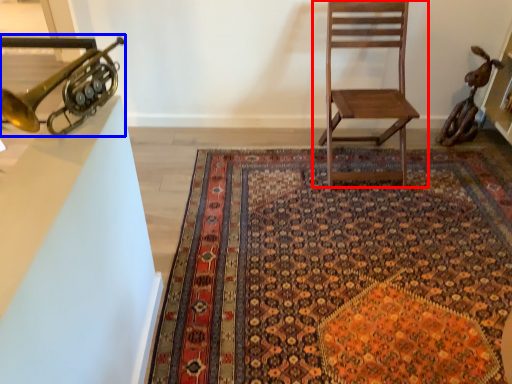
Question: Which point is further to the camera, chair (highlighted by a red box) or trumpet (highlighted by a blue box)?

Choices:
 (A) chair
 (B) trumpet

Answer: (A)